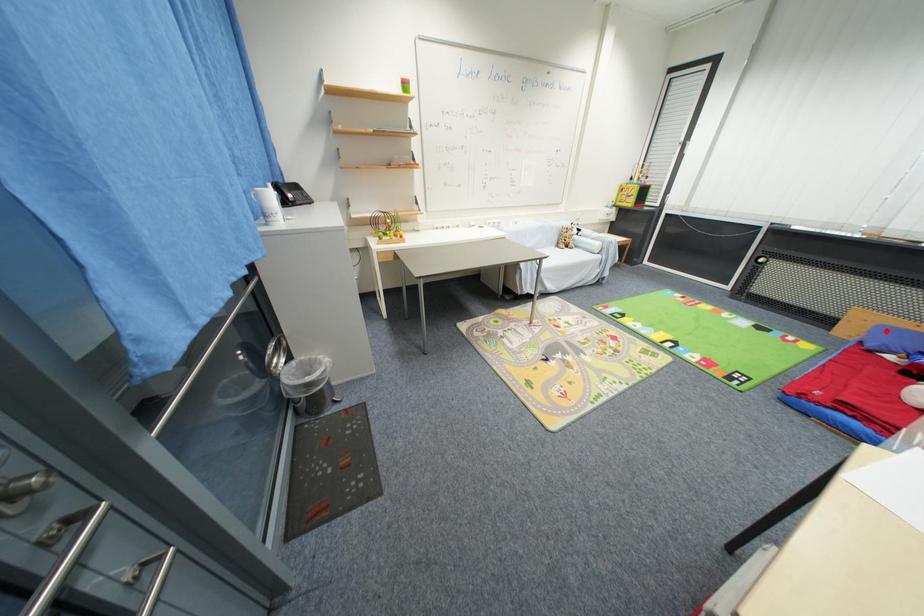
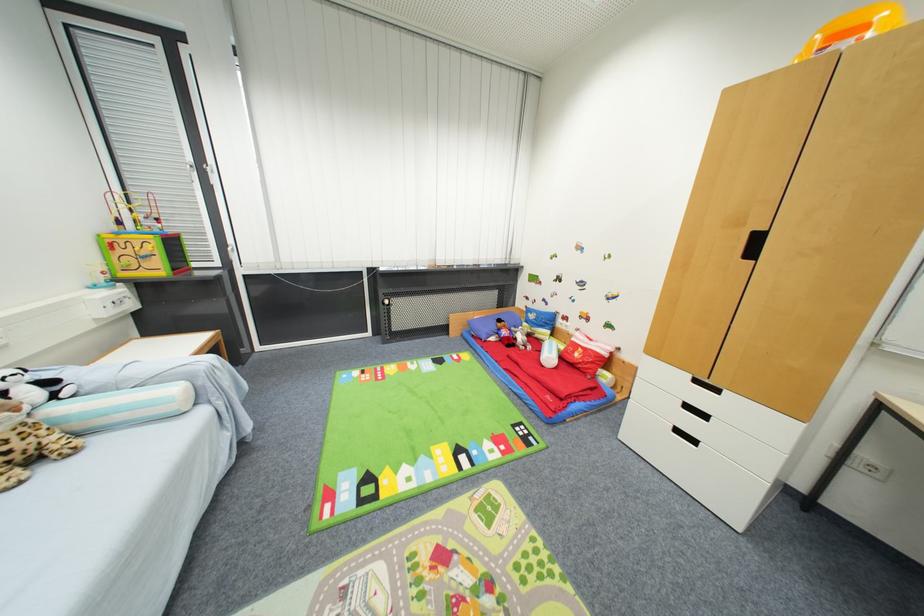
Where in the second image is the point corresponding to the highlighted location from the first image?

(475, 325)